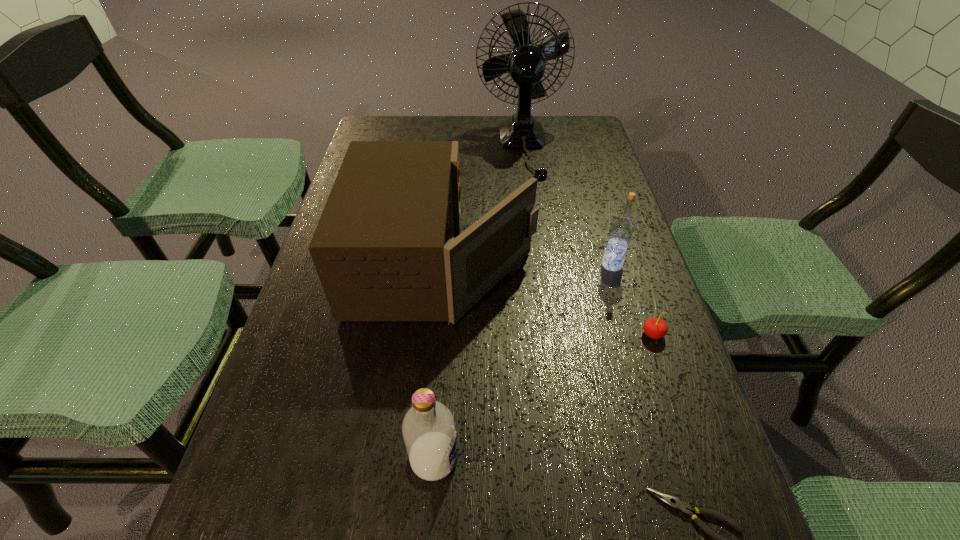
In the image, there is a desktop. At what (x,y) coordinates should I click in order to perform the action: click on vacant space at the right edge. Please return your answer as a coordinate pair (x, y). This screenshot has height=540, width=960. Looking at the image, I should click on click(612, 417).

Locate an element on the screen. blank space at the far right corner of the desktop is located at coordinates (566, 133).

Locate an element on the screen. The height and width of the screenshot is (540, 960). free space between the fifth farthest object and the tallest object is located at coordinates (479, 302).

Find the location of a particular element. free space between the farther vodka and the fan is located at coordinates (567, 205).

I want to click on vacant space in between the right vodka and the microwave oven, so click(x=528, y=264).

Where is `free space between the microwave oven and the second nearest object`? free space between the microwave oven and the second nearest object is located at coordinates (439, 361).

This screenshot has width=960, height=540. Identify the location of empty location between the cherry and the microwave oven. (548, 299).

Find the location of a particular element. The image size is (960, 540). unoccupied position between the second shortest object and the farther vodka is located at coordinates (633, 299).

Image resolution: width=960 pixels, height=540 pixels. Identify the location of empty space between the right vodka and the cherry. (633, 299).

The width and height of the screenshot is (960, 540). Find the location of `object that is the second nearest to the cherry`. object that is the second nearest to the cherry is located at coordinates (384, 249).